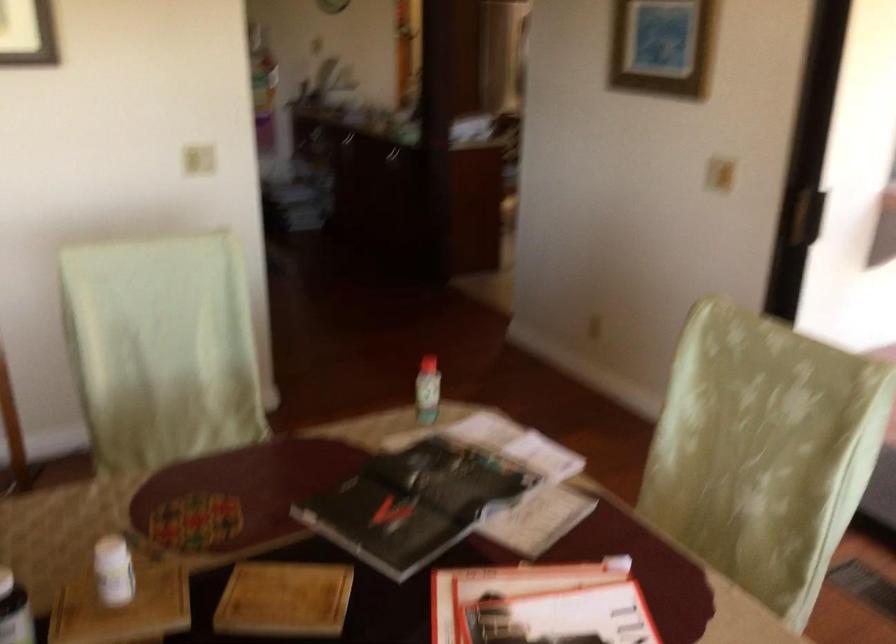
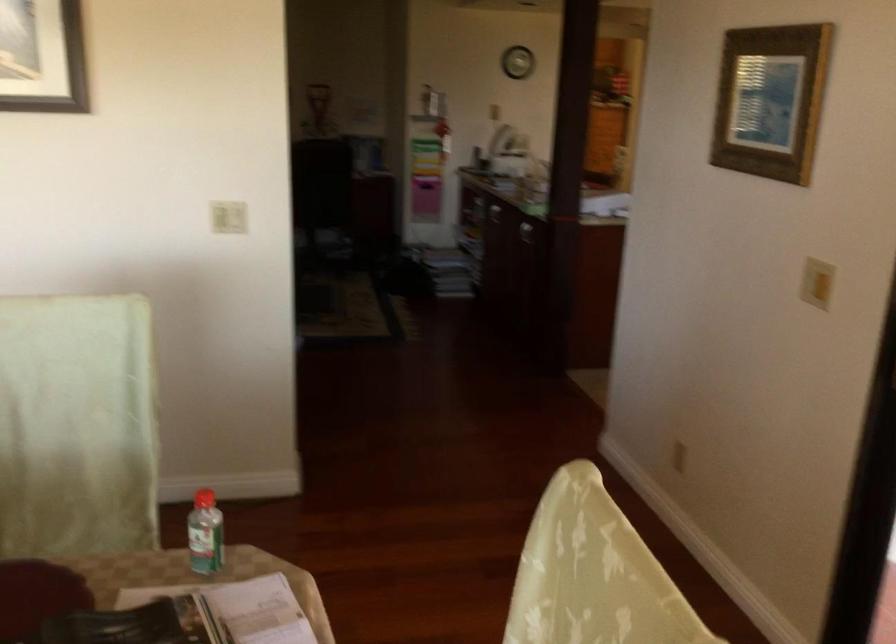
The point at (426, 362) is marked in the first image. Where is the corresponding point in the second image?

(203, 498)